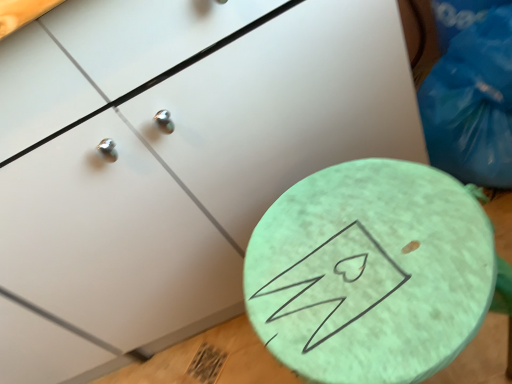
The image size is (512, 384). I want to click on vacant region above mint green textured table at center (from a real-world perspective), so click(371, 278).